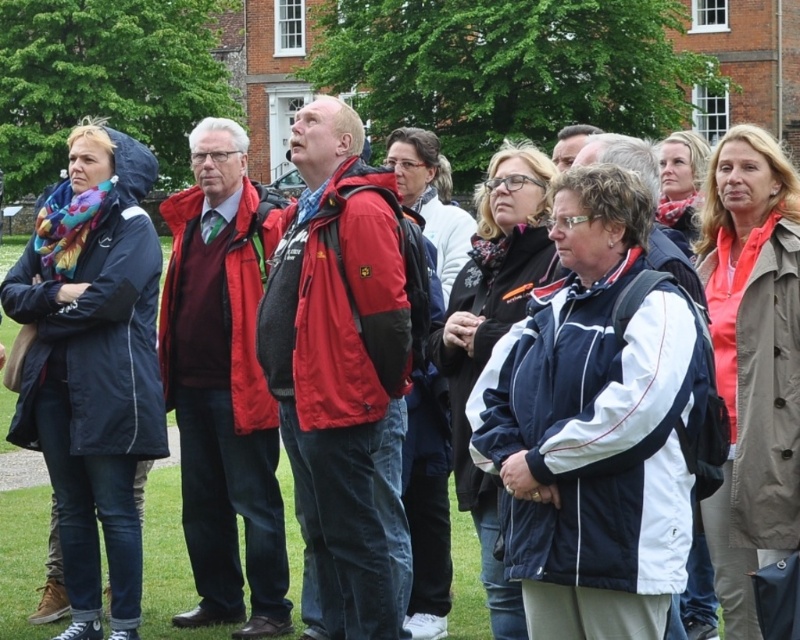
You are a photographer trying to capture both the matte red jacket at center and the matte red sweater at center in a single shot. Which object should you focus on first to ensure both are in frame, considering their sizes?

The matte red jacket at center is taller than the matte red sweater at center, so focus on the matte red jacket at center first to ensure both fit within the frame.